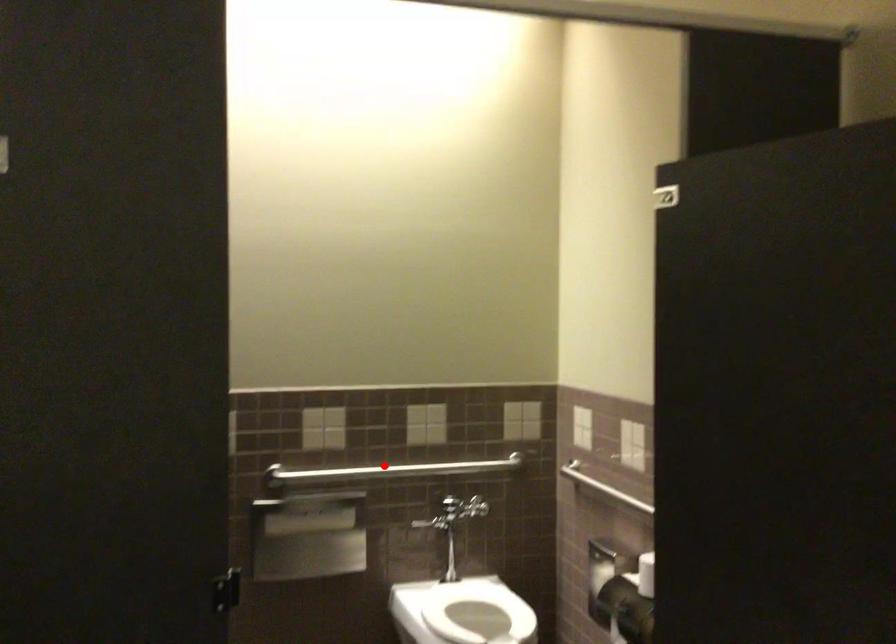
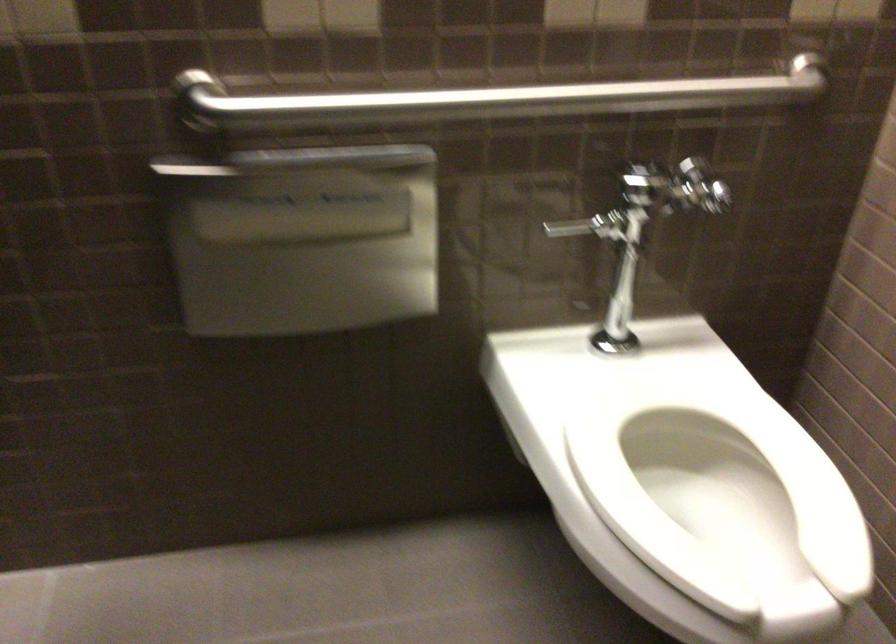
Question: A red point is marked in image1. In image2, is the corresponding 3D point closer to the camera or farther? Reply with the corresponding letter.

Choices:
 (A) The corresponding 3D point is closer.
 (B) The corresponding 3D point is farther.

Answer: (A)